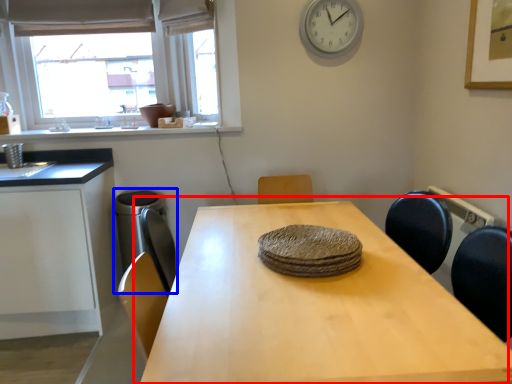
Question: Which object appears farthest to the camera in this image, table (highlighted by a red box) or appliance (highlighted by a blue box)?

Choices:
 (A) table
 (B) appliance

Answer: (B)